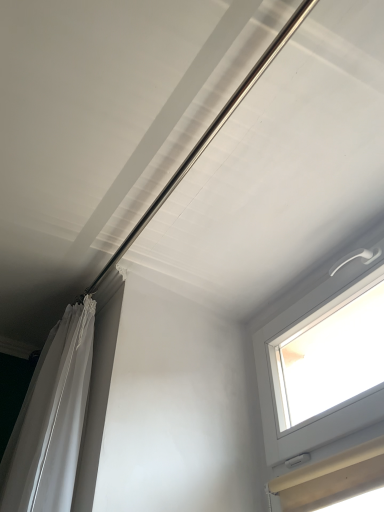
Describe the element at coordinates (51, 419) in the screenshot. The height and width of the screenshot is (512, 384). I see `white sheer curtain at left` at that location.

At what (x,y) coordinates should I click in order to perform the action: click on white sheer curtain at left. Please return your answer as a coordinate pair (x, y). The image size is (384, 512). Looking at the image, I should click on (51, 419).

This screenshot has height=512, width=384. In order to click on white sheer curtain at left in this screenshot , I will do `click(51, 419)`.